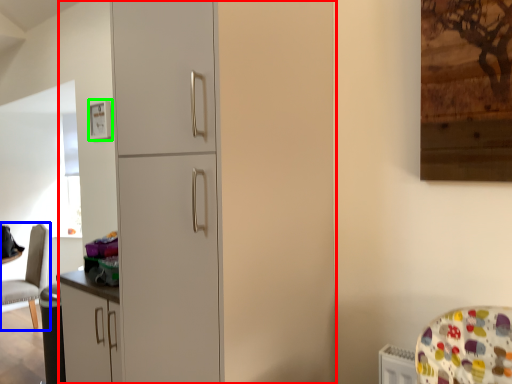
Question: Which is nearer to the dresser (highlighted by a red box)? chair (highlighted by a blue box) or picture frame (highlighted by a green box).

Choices:
 (A) chair
 (B) picture frame

Answer: (B)